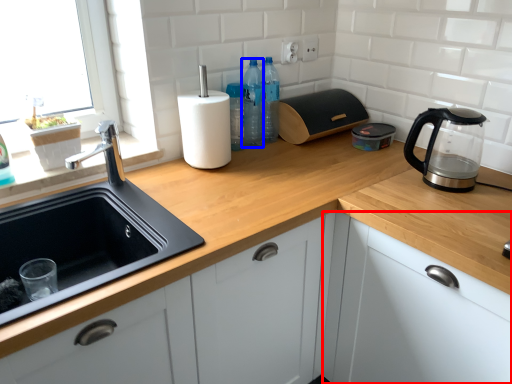
Question: Which point is further to the camera, cabinetry (highlighted by a red box) or bottle (highlighted by a blue box)?

Choices:
 (A) cabinetry
 (B) bottle

Answer: (B)